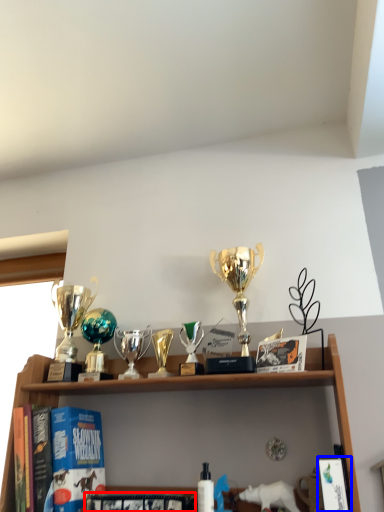
Question: Among these objects, which one is farthest to the camera, book (highlighted by a red box) or book (highlighted by a blue box)?

Choices:
 (A) book
 (B) book

Answer: (A)